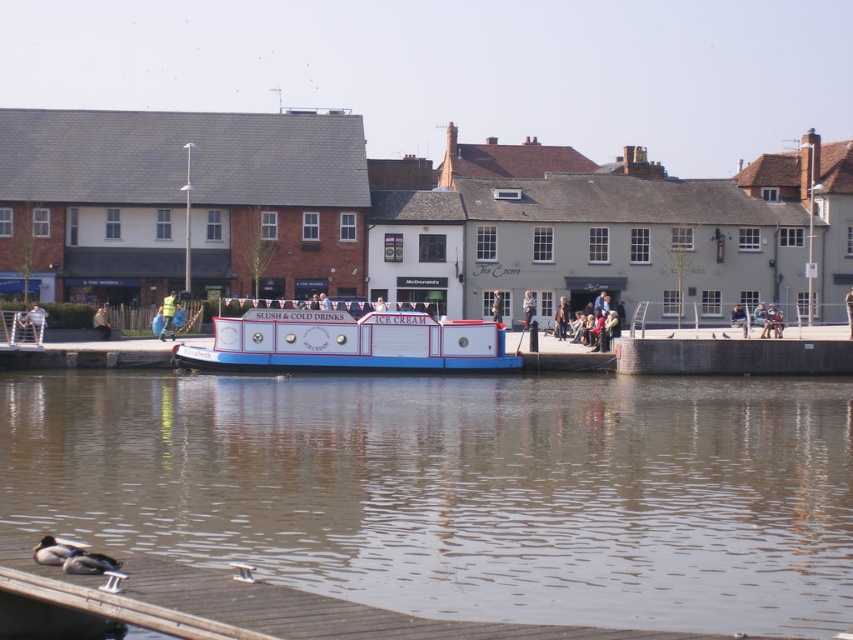
Question: Does brown wooden dock at lower left have a smaller size compared to yellow fabric person at center?

Choices:
 (A) no
 (B) yes

Answer: (A)

Question: Among these objects, which one is nearest to the camera?

Choices:
 (A) light brown wooden post at center
 (B) light blue fabric jacket at left
 (C) dark brown leather jacket at center

Answer: (B)

Question: Is light blue fabric jacket at left bigger than light brown wooden post at center?

Choices:
 (A) no
 (B) yes

Answer: (A)

Question: Among these objects, which one is nearest to the camera?

Choices:
 (A) dark brown leather jacket at center
 (B) light brown wooden post at center
 (C) light blue fabric jacket at left

Answer: (C)

Question: Can you confirm if brown wooden dock at lower left is positioned above yellow fabric person at center?

Choices:
 (A) no
 (B) yes

Answer: (A)

Question: Considering the real-world distances, which object is farthest from the dark brown leather jacket at center?

Choices:
 (A) brown wooden dock at lower left
 (B) yellow fabric person at center

Answer: (A)